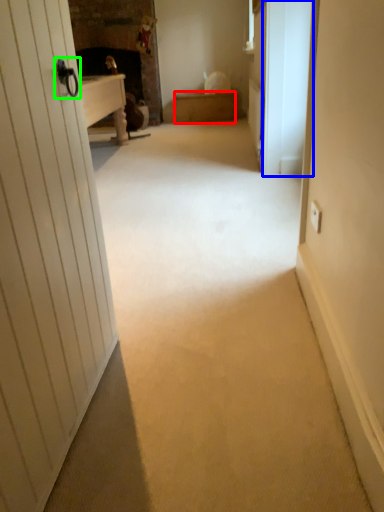
Question: Which object is the farthest from furniture (highlighted by a red box)? Choose among these: screen door (highlighted by a blue box) or door handle (highlighted by a green box).

Choices:
 (A) screen door
 (B) door handle

Answer: (B)